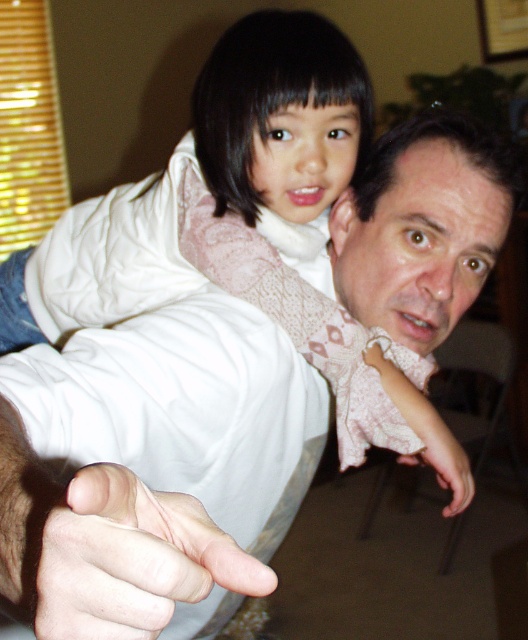
Which is in front, point (135, 477) or point (456, 500)?

Point (135, 477) is in front.

Is white matte hand at center above pink lace sleeve at upper center?

Indeed, white matte hand at center is positioned over pink lace sleeve at upper center.

Is point (183, 541) less distant than point (457, 456)?

Yes, it is in front of point (457, 456).

In order to click on white matte hand at center in this screenshot , I will do `click(132, 557)`.